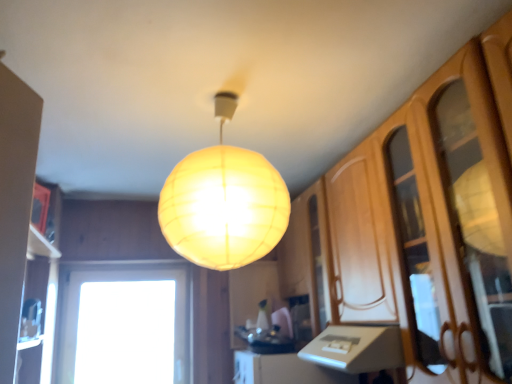
Question: From their relative heights in the image, would you say translucent yellow sphere at center is taller or shorter than wooden cabinet at right?

Choices:
 (A) short
 (B) tall

Answer: (A)

Question: Is translucent yellow sphere at center wider or thinner than wooden cabinet at right?

Choices:
 (A) wide
 (B) thin

Answer: (A)

Question: Estimate the real-world distances between objects in this image. Which object is closer to the translucent yellow sphere at center?

Choices:
 (A) wooden cabinet at right
 (B) transparent glass window at lower left

Answer: (A)

Question: Estimate the real-world distances between objects in this image. Which object is farther from the translucent yellow sphere at center?

Choices:
 (A) wooden cabinet at right
 (B) transparent glass window at lower left

Answer: (B)